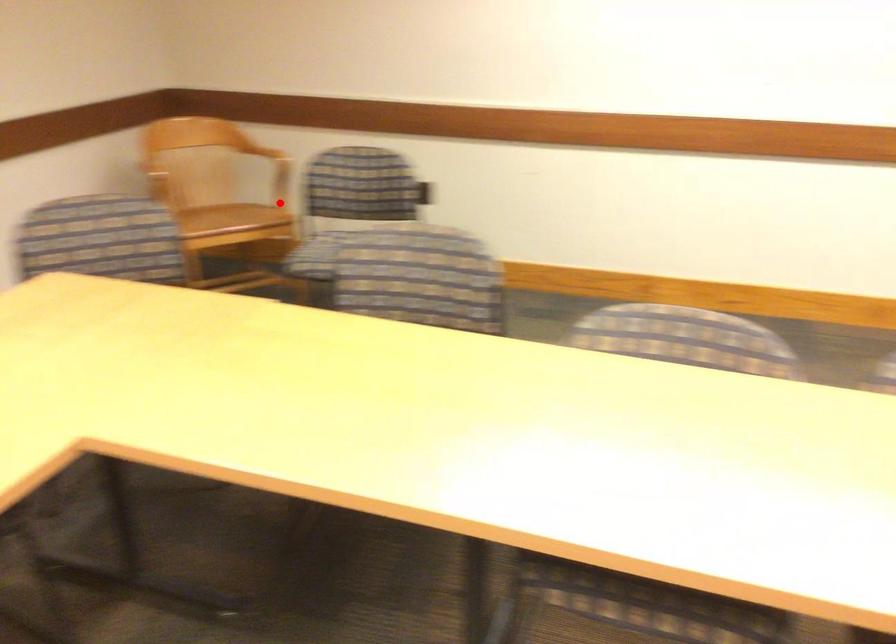
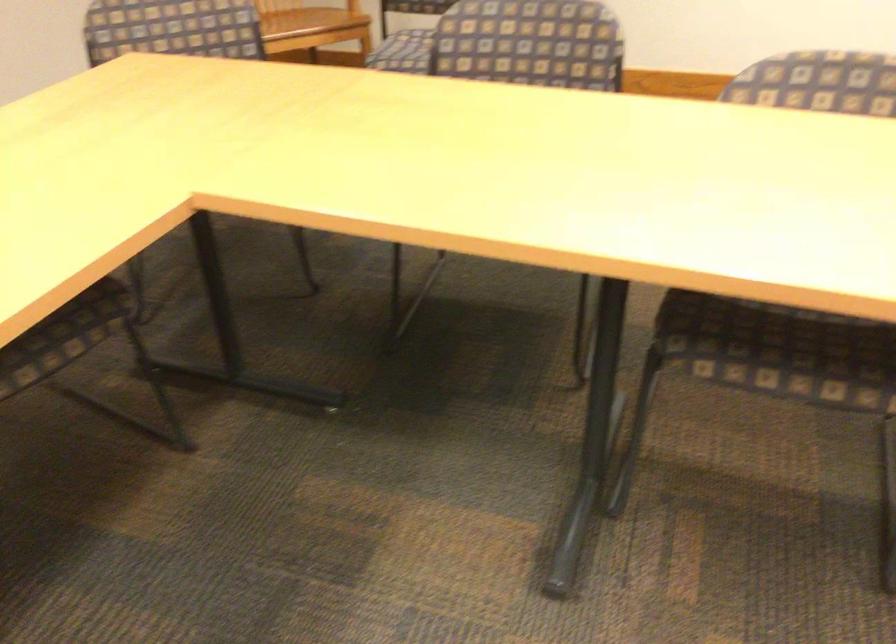
Where in the second image is the point corresponding to the highlighted location from the first image?

(352, 6)